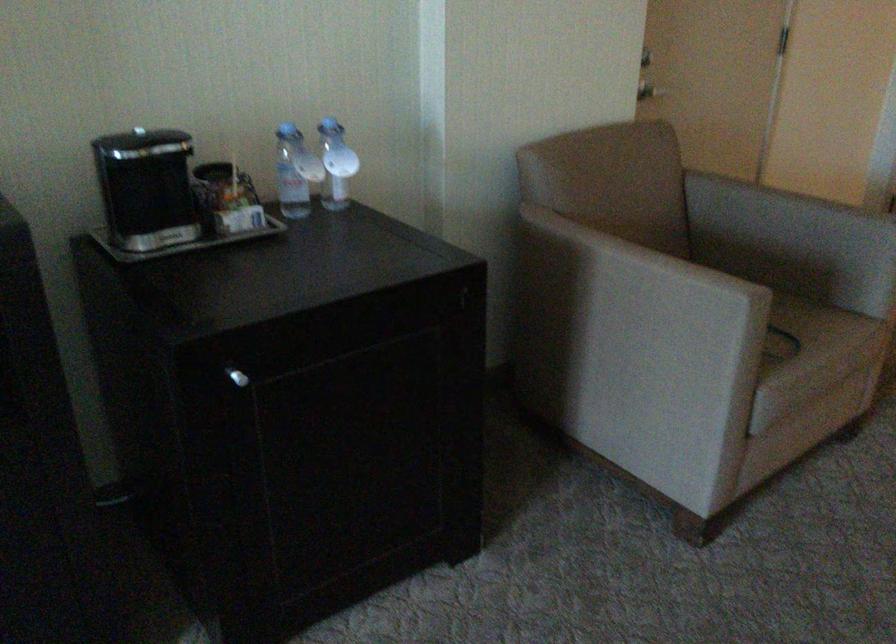
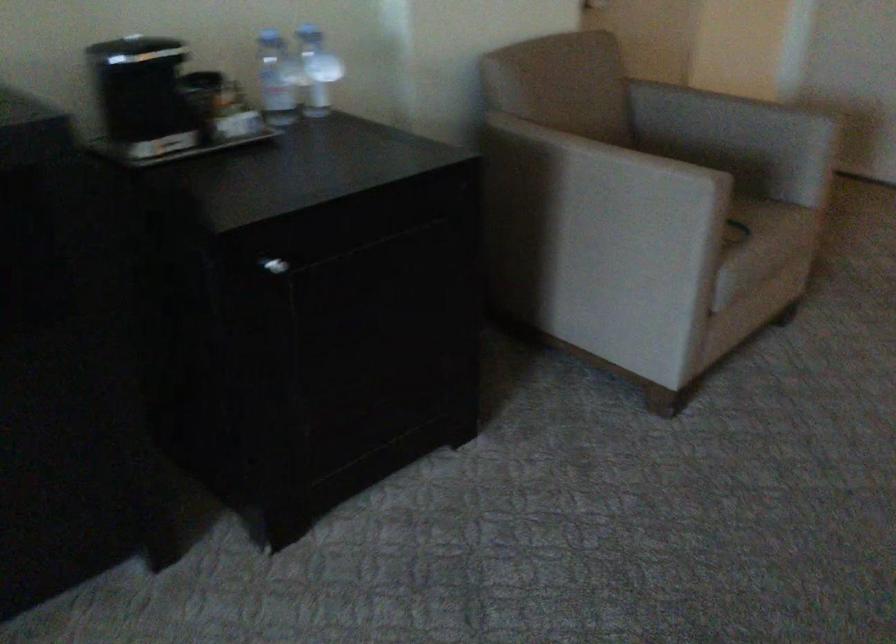
Question: How did the camera likely rotate?

Choices:
 (A) Left
 (B) Right
 (C) Up
 (D) Down

Answer: (B)